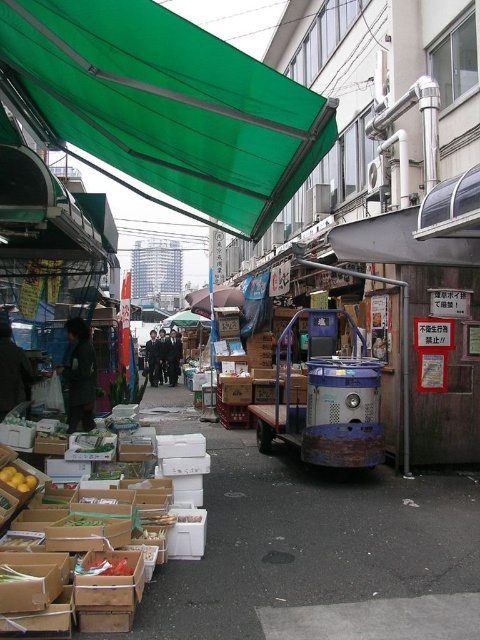
Based on the photo, you are a customer at the market and want to find shade while waiting for your order. You see the green fabric canopy at upper center and the blue metallic cart at center. Which object can provide shade?

The green fabric canopy at upper center is above the blue metallic cart at center, so the green fabric canopy at upper center can provide shade.

You are standing at the market entrance and want to walk towards both the point at coordinates (248,145) and the point at coordinates (1,477). Which point will you reach first?

You will reach the point at coordinates (1,477) first because it is closer to you than the point at coordinates (248,145), which is further away.